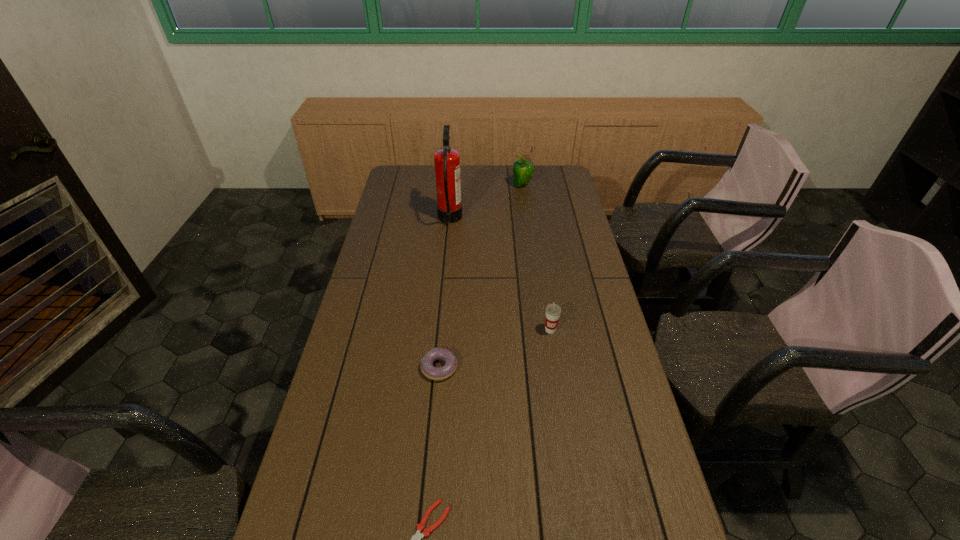
This screenshot has width=960, height=540. What are the coordinates of `free point between the fourth shortest object and the doughnut` in the screenshot? It's located at (481, 276).

I want to click on empty space that is in between the fire extinguisher and the bell pepper, so click(x=486, y=202).

Where is `vacant point located between the bell pepper and the fourth farthest object`? The height and width of the screenshot is (540, 960). vacant point located between the bell pepper and the fourth farthest object is located at coordinates (481, 276).

Select which object appears as the fourth closest to the third tallest object. Please provide its 2D coordinates. Your answer should be formatted as a tuple, i.e. [(x, y)], where the tuple contains the x and y coordinates of a point satisfying the conditions above.

[(523, 170)]

Choose which object is the third nearest neighbor to the cup. Please provide its 2D coordinates. Your answer should be formatted as a tuple, i.e. [(x, y)], where the tuple contains the x and y coordinates of a point satisfying the conditions above.

[(415, 539)]

In order to click on vacant space that satisfies the following two spatial constraints: 1. on the front-facing side of the fire extinguisher; 2. on the right side of the doughnut in this screenshot , I will do `click(437, 368)`.

You are a GUI agent. You are given a task and a screenshot of the screen. Output one action in this format:
    pyautogui.click(x=<x>, y=<y>)
    Task: Click on the vacant point that satisfies the following two spatial constraints: 1. on the front-facing side of the doughnut; 2. on the right side of the tallest object
    The width and height of the screenshot is (960, 540).
    Given the screenshot: What is the action you would take?
    pyautogui.click(x=437, y=368)

The image size is (960, 540). Identify the location of blank space that satisfies the following two spatial constraints: 1. on the back side of the second tallest object; 2. on the right side of the fourth farthest object. (454, 185).